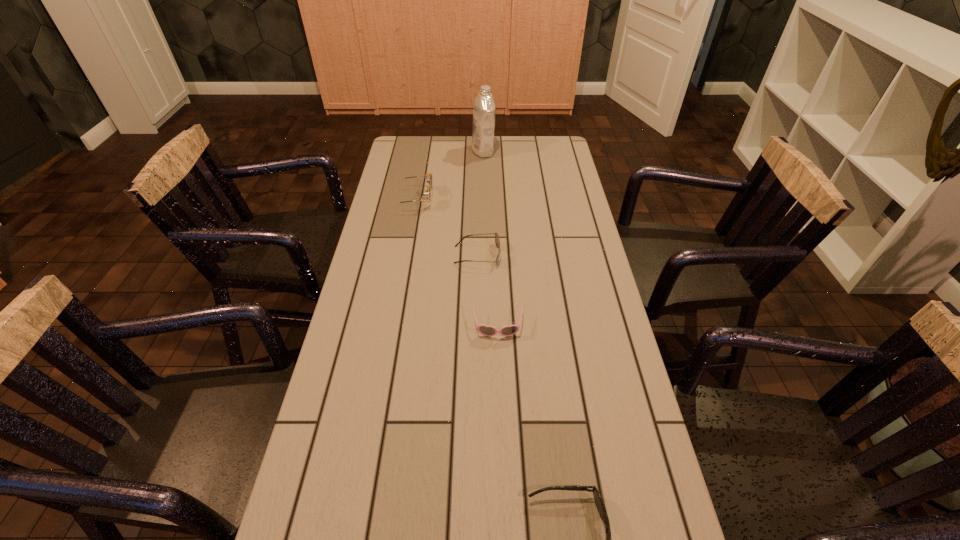
Find the location of a particular element. The height and width of the screenshot is (540, 960). object that is at the far edge is located at coordinates (482, 144).

At what (x,y) coordinates should I click in order to perform the action: click on object located at the left edge. Please return your answer as a coordinate pair (x, y). This screenshot has height=540, width=960. Looking at the image, I should click on (428, 177).

This screenshot has height=540, width=960. In order to click on vacant region at the far edge of the desktop in this screenshot , I will do `click(469, 164)`.

Locate an element on the screen. vacant space at the left edge of the desktop is located at coordinates (310, 453).

Locate an element on the screen. vacant space at the right edge is located at coordinates pyautogui.click(x=584, y=262).

This screenshot has height=540, width=960. In the image, there is a desktop. Find the location of `vacant space at the far left corner`. vacant space at the far left corner is located at coordinates (408, 143).

Locate an element on the screen. Image resolution: width=960 pixels, height=540 pixels. free space at the far right corner of the desktop is located at coordinates (530, 157).

This screenshot has width=960, height=540. I want to click on free area in between the tallest object and the leftmost sunglasses, so click(448, 175).

Identify the location of free point between the tallest object and the fourth nearest object. (448, 175).

Find the location of a particular element. free point between the tallest object and the third farthest object is located at coordinates (480, 203).